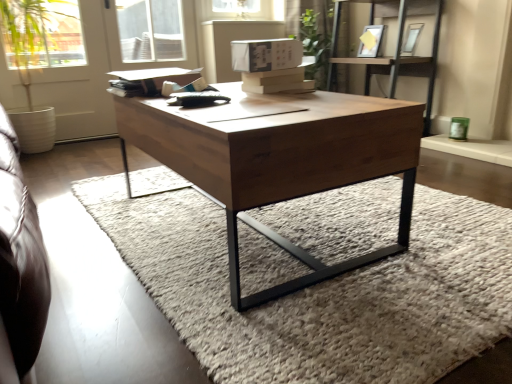
Question: Can you confirm if matte silver picture frame at upper right, arranged as the 2th picture frame when viewed from the left, is positioned to the right of wooden shelf at upper right?

Choices:
 (A) yes
 (B) no

Answer: (A)

Question: From a real-world perspective, is matte silver picture frame at upper right, arranged as the 2th picture frame when viewed from the left, positioned over wooden shelf at upper right based on gravity?

Choices:
 (A) yes
 (B) no

Answer: (A)

Question: Is matte silver picture frame at upper right, which is the 1th picture frame in right-to-left order, wider than wooden shelf at upper right?

Choices:
 (A) yes
 (B) no

Answer: (B)

Question: Is matte silver picture frame at upper right, arranged as the 2th picture frame when viewed from the left, not close to wooden shelf at upper right?

Choices:
 (A) yes
 (B) no

Answer: (B)

Question: Is wooden shelf at upper right completely or partially inside matte silver picture frame at upper right, which is the 1th picture frame in right-to-left order?

Choices:
 (A) yes
 (B) no

Answer: (B)

Question: Looking at their shapes, would you say matte silver picture frame at upper right, which is the 1th picture frame in right-to-left order, is wider or thinner than wooden coffee table at center?

Choices:
 (A) wide
 (B) thin

Answer: (B)

Question: From the image's perspective, is matte silver picture frame at upper right, arranged as the 2th picture frame when viewed from the left, positioned above or below wooden coffee table at center?

Choices:
 (A) below
 (B) above

Answer: (B)

Question: From their relative heights in the image, would you say matte silver picture frame at upper right, which is the 1th picture frame in right-to-left order, is taller or shorter than wooden coffee table at center?

Choices:
 (A) tall
 (B) short

Answer: (B)

Question: Is point (403, 44) closer or farther from the camera than point (247, 296)?

Choices:
 (A) closer
 (B) farther

Answer: (B)

Question: Based on their sizes in the image, would you say transparent glass window at upper center is bigger or smaller than white matte screen door at upper left?

Choices:
 (A) small
 (B) big

Answer: (A)

Question: Looking at their shapes, would you say transparent glass window at upper center is wider or thinner than white matte screen door at upper left?

Choices:
 (A) thin
 (B) wide

Answer: (B)

Question: Considering the positions of transparent glass window at upper center and white matte screen door at upper left in the image, is transparent glass window at upper center taller or shorter than white matte screen door at upper left?

Choices:
 (A) short
 (B) tall

Answer: (A)

Question: Based on their positions, is transparent glass window at upper center located to the left or right of white matte screen door at upper left?

Choices:
 (A) right
 (B) left

Answer: (A)

Question: From the image's perspective, is green leafy plant at upper center positioned above or below matte white picture frame at upper center, positioned as the 1th picture frame in left-to-right order?

Choices:
 (A) above
 (B) below

Answer: (A)

Question: Considering their positions, is green leafy plant at upper center located in front of or behind matte white picture frame at upper center, positioned as the 1th picture frame in left-to-right order?

Choices:
 (A) behind
 (B) front

Answer: (A)